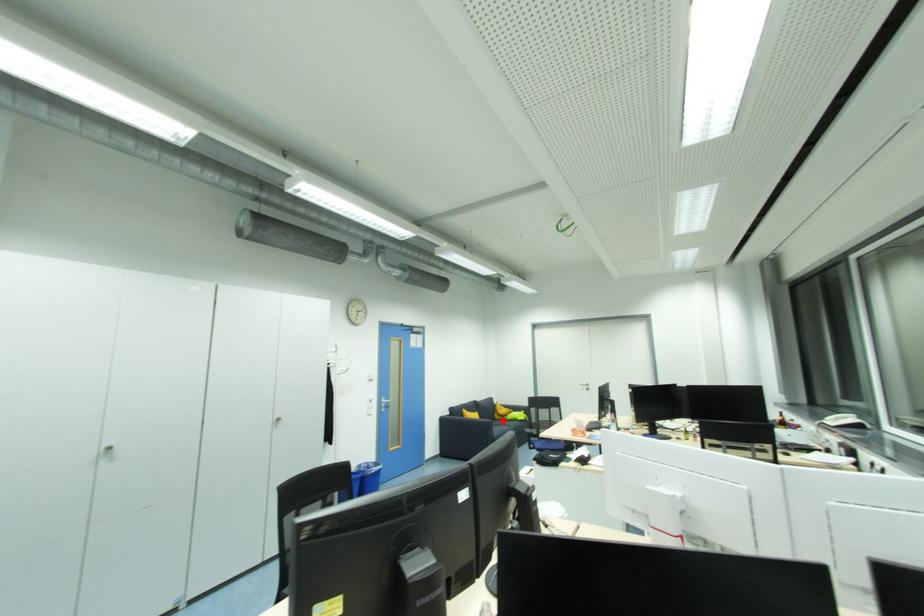
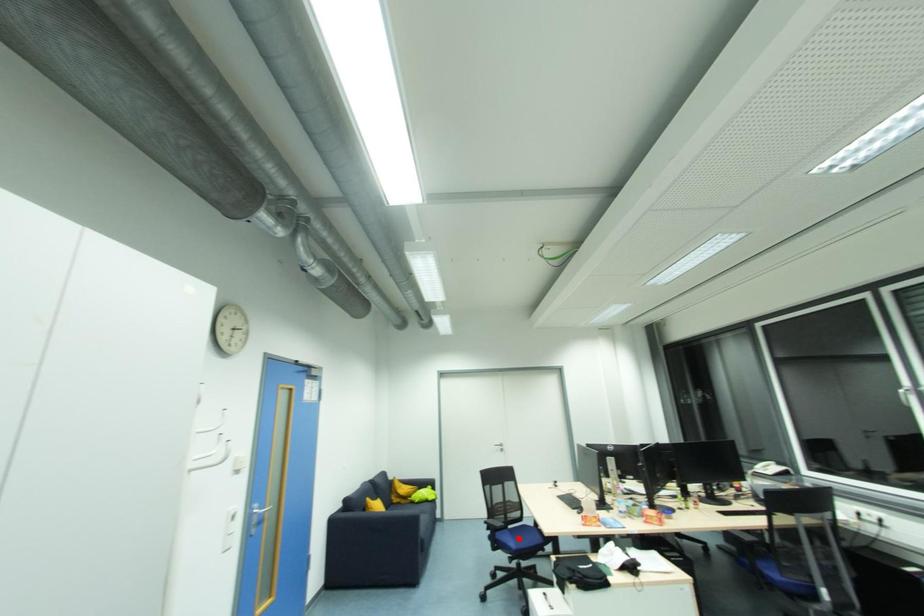
I am providing you with two images of the same scene from different viewpoints. A red point is marked on the first image and another point is marked on the second image. Do the highlighted points in image1 and image2 indicate the same real-world spot?

No